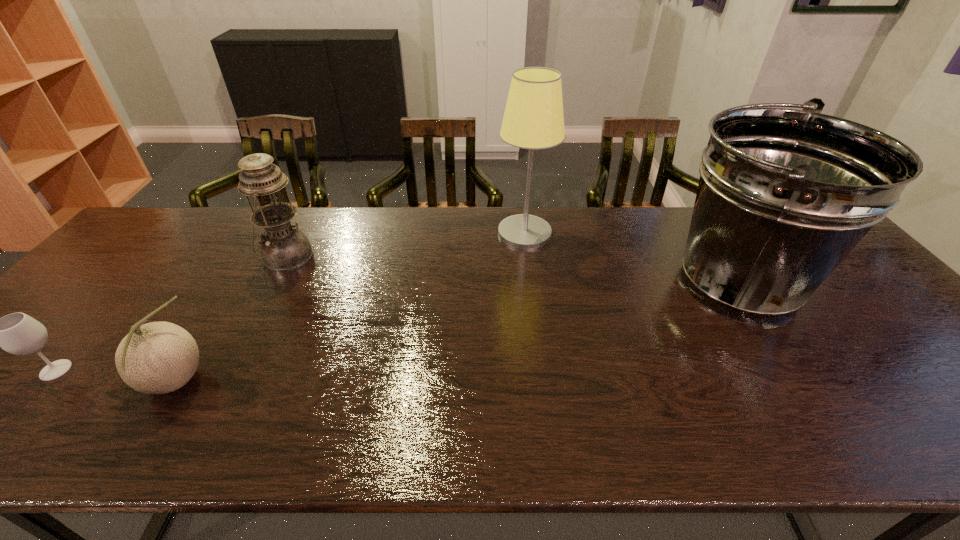
At what (x,y) coordinates should I click in order to perform the action: click on blank region between the rightmost object and the cantaloup. Please return your answer as a coordinate pair (x, y). The height and width of the screenshot is (540, 960). Looking at the image, I should click on (455, 333).

Find the location of a particular element. Image resolution: width=960 pixels, height=540 pixels. free spot between the shortest object and the rightmost object is located at coordinates (396, 327).

The width and height of the screenshot is (960, 540). Identify the location of free space between the leftmost object and the table lamp. (290, 301).

Find the location of a particular element. The width and height of the screenshot is (960, 540). vacant point located between the third tallest object and the cantaloup is located at coordinates (230, 320).

At what (x,y) coordinates should I click in order to perform the action: click on vacant region between the leftmost object and the table lamp. Please return your answer as a coordinate pair (x, y). Looking at the image, I should click on (290, 301).

Identify the location of vacant space that's between the leftmost object and the second object from right to left. The image size is (960, 540). (290, 301).

You are a GUI agent. You are given a task and a screenshot of the screen. Output one action in this format:
    pyautogui.click(x=<x>, y=<y>)
    Task: Click on the free spot between the oil lamp and the bucket
    The image size is (960, 540).
    Given the screenshot: What is the action you would take?
    tap(512, 271)

The image size is (960, 540). In order to click on free spot between the wineglass and the bucket in this screenshot , I will do `click(396, 327)`.

Image resolution: width=960 pixels, height=540 pixels. I want to click on object that ranks as the fourth closest to the shortest object, so 784,195.

Identify the location of the fourth closest object to the shortest object. This screenshot has width=960, height=540. (784, 195).